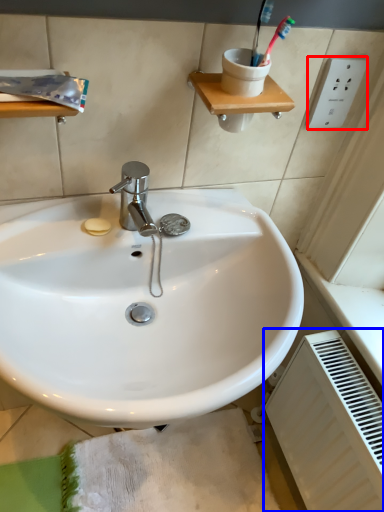
Question: Among these objects, which one is farthest to the camera, electric outlet (highlighted by a red box) or radiator (highlighted by a blue box)?

Choices:
 (A) electric outlet
 (B) radiator

Answer: (A)